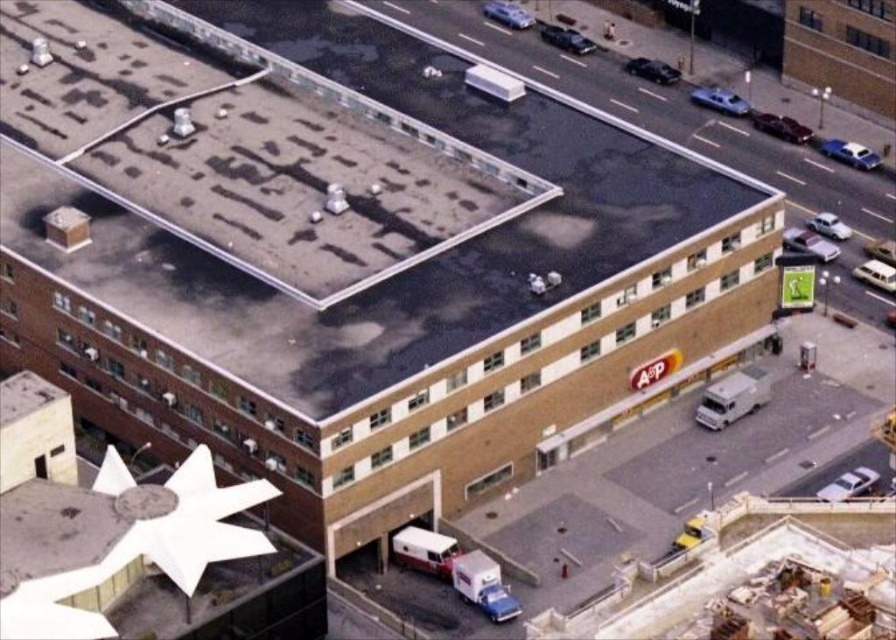
Consider the image. You are a delivery driver who needs to park your vehicle in the loading dock area shown in the image. You have a truck that is 5 meters long. The shiny blue sedan at right and the white matte car at upper right are already parked there. Based on the description, which car takes up less space in the parking area?

The shiny blue sedan at right is shorter than the white matte car at upper right, so it takes up less space in the parking area.

You are a delivery driver who needs to park your vehicle in the loading dock area. You have a new delivery truck that is the same size as the white matte car at upper right. Is there enough space to park your truck next to the shiny blue sedan at right without overlapping?

The shiny blue sedan at right occupies less space than the white matte car at upper right, so there is enough space to park the truck next to the shiny blue sedan at right without overlapping.

You are a delivery driver who needs to park your truck next to the shiny maroon sedan at right and the silver metallic sedan at upper right. Which vehicle should you park next to if you want to maximize the available space for your truck?

The shiny maroon sedan at right has a smaller width than the silver metallic sedan at upper right, so parking next to the shiny maroon sedan at right would leave more space for your truck.